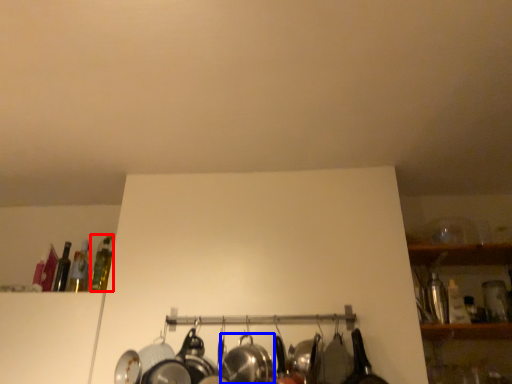
Question: Which object appears closest to the camera in this image, bottle (highlighted by a red box) or wok (highlighted by a blue box)?

Choices:
 (A) bottle
 (B) wok

Answer: (B)